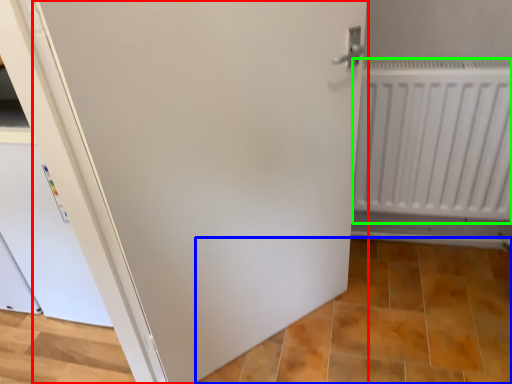
Question: Estimate the real-world distances between objects in this image. Which object is farther from door (highlighted by a red box), tile (highlighted by a blue box) or radiator (highlighted by a green box)?

Choices:
 (A) tile
 (B) radiator

Answer: (A)